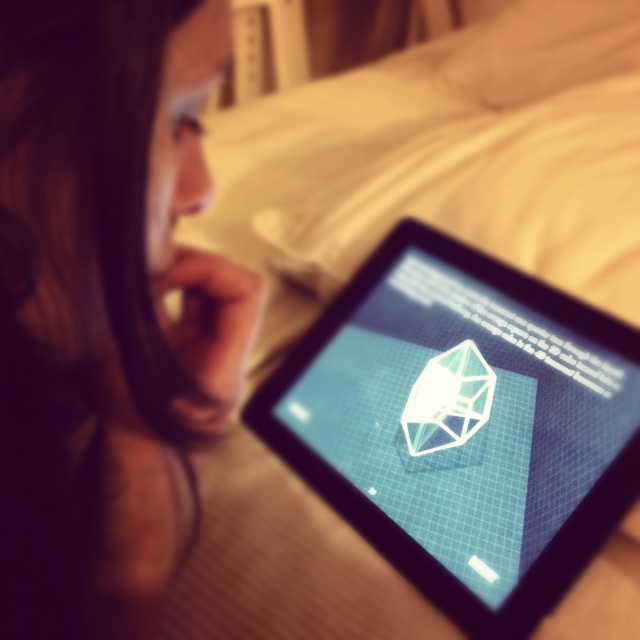
This screenshot has width=640, height=640. What do you see at coordinates (106, 307) in the screenshot? I see `brown hair at upper left` at bounding box center [106, 307].

Which is in front, point (100, 444) or point (444, 339)?

Point (100, 444)

The height and width of the screenshot is (640, 640). Identify the location of brown hair at upper left. (106, 307).